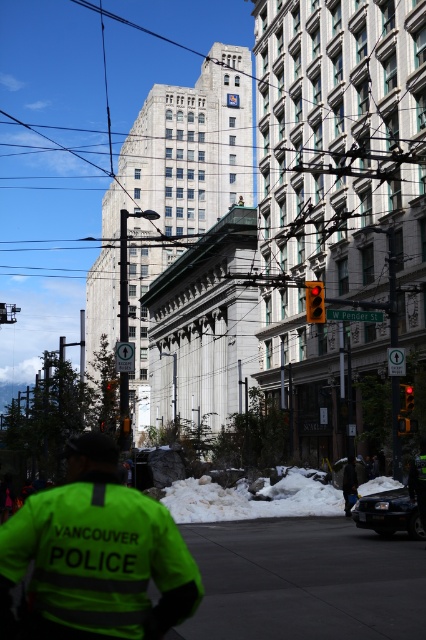
You are a delivery driver navigating through the urban street scene. You need to locate the neon yellow reflective vest at center. According to the coordinates provided, where exactly is it positioned?

The neon yellow reflective vest at center is located at point (97, 554).

You are a pedestrian on the street and you see the neon yellow reflective vest at center and the neon yellow reflective jacket at lower center. You want to cross the street to the building on the left. Which of the two items is closer to you?

The neon yellow reflective jacket at lower center is closer to you since it is positioned at lower center, which is typically nearer in such scenes compared to items at center, and the distance between them is 21.10 meters.

You are a pedestrian standing at the edge of the snow covered area in the urban street scene. You want to cross the street to reach a nearby coffee shop located behind the neon yellow reflective vest at center. Considering the distance between you and the vest, can you safely cross the street without needing to move closer than 10 feet?

The distance between you and the neon yellow reflective vest at center is 11.58 feet, which is more than 10 feet. Therefore, you can safely cross the street without needing to move closer than 10 feet to the neon yellow reflective vest at center.